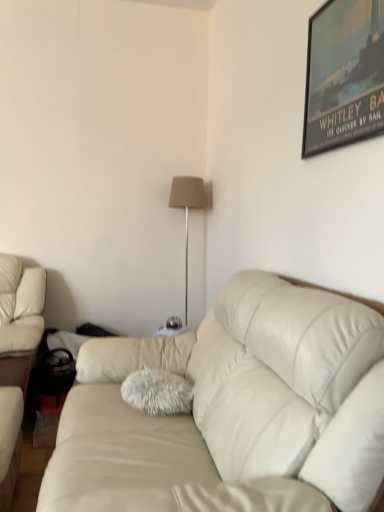
Question: Could you tell me if metallic poster at upper right is facing fuzzy teal throw pillow at center?

Choices:
 (A) yes
 (B) no

Answer: (B)

Question: From a real-world perspective, does metallic poster at upper right sit lower than fuzzy teal throw pillow at center?

Choices:
 (A) yes
 (B) no

Answer: (B)

Question: From the image's perspective, would you say metallic poster at upper right is positioned over fuzzy teal throw pillow at center?

Choices:
 (A) yes
 (B) no

Answer: (A)

Question: Does metallic poster at upper right have a lesser height compared to fuzzy teal throw pillow at center?

Choices:
 (A) no
 (B) yes

Answer: (A)

Question: Can you confirm if metallic poster at upper right is smaller than fuzzy teal throw pillow at center?

Choices:
 (A) yes
 (B) no

Answer: (A)

Question: Is metallic poster at upper right thinner than fuzzy teal throw pillow at center?

Choices:
 (A) no
 (B) yes

Answer: (B)

Question: Considering the relative sizes of beige fabric lampshade at center and leather couch at center in the image provided, is beige fabric lampshade at center thinner than leather couch at center?

Choices:
 (A) no
 (B) yes

Answer: (B)

Question: Is beige fabric lampshade at center directly adjacent to leather couch at center?

Choices:
 (A) no
 (B) yes

Answer: (A)

Question: Is the depth of beige fabric lampshade at center greater than that of leather couch at center?

Choices:
 (A) no
 (B) yes

Answer: (B)

Question: Is beige fabric lampshade at center oriented towards leather couch at center?

Choices:
 (A) no
 (B) yes

Answer: (B)

Question: From the image's perspective, is beige fabric lampshade at center under leather couch at center?

Choices:
 (A) yes
 (B) no

Answer: (B)

Question: From the image's perspective, is beige fabric lampshade at center on top of leather couch at center?

Choices:
 (A) no
 (B) yes

Answer: (B)

Question: From a real-world perspective, is beige fabric lampshade at center on metallic poster at upper right?

Choices:
 (A) yes
 (B) no

Answer: (B)